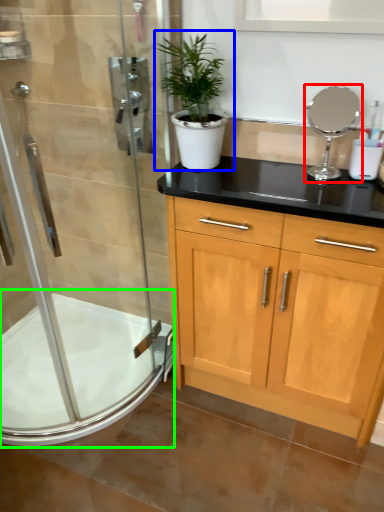
Question: Which object is the farthest from mirror (highlighted by a red box)? Choose among these: houseplant (highlighted by a blue box) or bath (highlighted by a green box).

Choices:
 (A) houseplant
 (B) bath

Answer: (B)